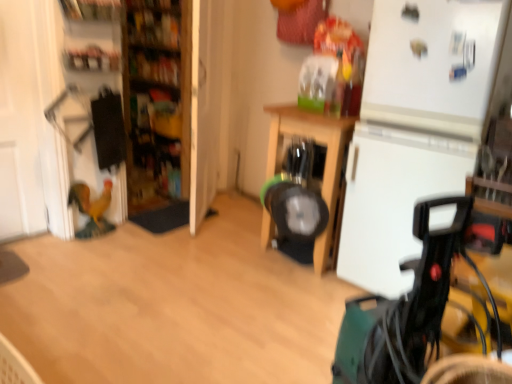
Question: Does wooden bookshelf at upper left, marked as the 1th shelf in a top-to-bottom arrangement, have a smaller size compared to wooden shelves at left?

Choices:
 (A) no
 (B) yes

Answer: (B)

Question: From a real-world perspective, does wooden bookshelf at upper left, marked as the 1th shelf in a top-to-bottom arrangement, sit lower than wooden shelves at left?

Choices:
 (A) no
 (B) yes

Answer: (A)

Question: Is wooden bookshelf at upper left, marked as the 1th shelf in a top-to-bottom arrangement, far away from wooden shelves at left?

Choices:
 (A) no
 (B) yes

Answer: (B)

Question: Is wooden bookshelf at upper left, marked as the 1th shelf in a top-to-bottom arrangement, directly adjacent to wooden shelves at left?

Choices:
 (A) yes
 (B) no

Answer: (B)

Question: Is wooden bookshelf at upper left, marked as the 1th shelf in a top-to-bottom arrangement, positioned with its back to wooden shelves at left?

Choices:
 (A) yes
 (B) no

Answer: (B)

Question: Considering the relative sizes of wooden bookshelf at upper left, marked as the 1th shelf in a top-to-bottom arrangement, and wooden shelves at left in the image provided, is wooden bookshelf at upper left, marked as the 1th shelf in a top-to-bottom arrangement, bigger than wooden shelves at left?

Choices:
 (A) no
 (B) yes

Answer: (A)

Question: Can you confirm if white matte refrigerator at right is thinner than wooden table at center?

Choices:
 (A) no
 (B) yes

Answer: (B)

Question: Can you confirm if white matte refrigerator at right is positioned to the right of wooden table at center?

Choices:
 (A) no
 (B) yes

Answer: (B)

Question: Could wooden table at center be considered to be inside white matte refrigerator at right?

Choices:
 (A) no
 (B) yes

Answer: (A)

Question: Considering the relative sizes of white matte refrigerator at right and wooden table at center in the image provided, is white matte refrigerator at right wider than wooden table at center?

Choices:
 (A) yes
 (B) no

Answer: (B)

Question: From a real-world perspective, is white matte refrigerator at right below wooden table at center?

Choices:
 (A) no
 (B) yes

Answer: (A)

Question: From the image's perspective, does white matte refrigerator at right appear lower than wooden table at center?

Choices:
 (A) no
 (B) yes

Answer: (B)

Question: From the image's perspective, is wooden bookshelf at upper left, positioned as the 2th shelf in bottom-to-top order, below green plastic baby carriage at lower right?

Choices:
 (A) yes
 (B) no

Answer: (B)